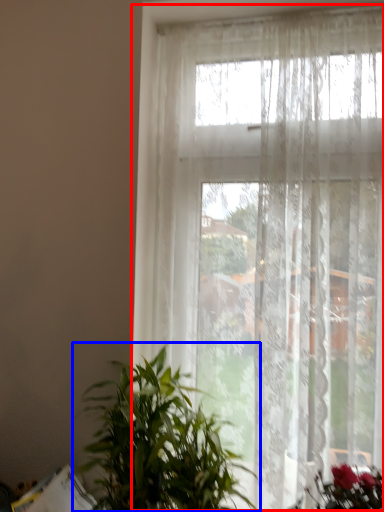
Question: Among these objects, which one is farthest to the camera, window (highlighted by a red box) or houseplant (highlighted by a blue box)?

Choices:
 (A) window
 (B) houseplant

Answer: (A)